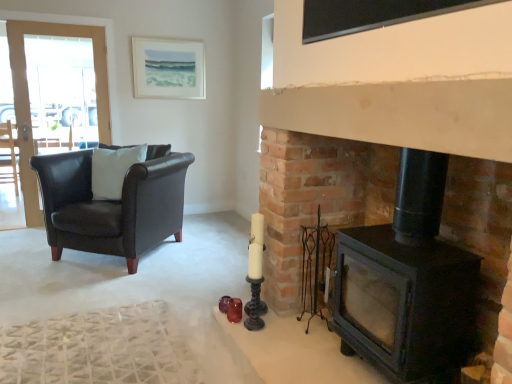
Question: Is black matte fireplace at right not near clear glass screen door at left?

Choices:
 (A) no
 (B) yes

Answer: (B)

Question: From a real-world perspective, is black matte fireplace at right located beneath clear glass screen door at left?

Choices:
 (A) no
 (B) yes

Answer: (B)

Question: From the image's perspective, is black matte fireplace at right on top of clear glass screen door at left?

Choices:
 (A) yes
 (B) no

Answer: (B)

Question: From a real-world perspective, is black matte fireplace at right physically above clear glass screen door at left?

Choices:
 (A) no
 (B) yes

Answer: (A)

Question: Is black matte fireplace at right to the left of clear glass screen door at left from the viewer's perspective?

Choices:
 (A) yes
 (B) no

Answer: (B)

Question: Could clear glass screen door at left be considered to be inside black matte fireplace at right?

Choices:
 (A) no
 (B) yes

Answer: (A)

Question: Considering the relative sizes of white matte pillow at left and black matte fireplace at right in the image provided, is white matte pillow at left smaller than black matte fireplace at right?

Choices:
 (A) yes
 (B) no

Answer: (A)

Question: Can you confirm if white matte pillow at left is positioned to the left of black matte fireplace at right?

Choices:
 (A) no
 (B) yes

Answer: (B)

Question: Considering the relative sizes of white matte pillow at left and black matte fireplace at right in the image provided, is white matte pillow at left thinner than black matte fireplace at right?

Choices:
 (A) no
 (B) yes

Answer: (B)

Question: From a real-world perspective, is white matte pillow at left on top of black matte fireplace at right?

Choices:
 (A) yes
 (B) no

Answer: (A)

Question: From a real-world perspective, is white matte pillow at left positioned under black matte fireplace at right based on gravity?

Choices:
 (A) no
 (B) yes

Answer: (A)

Question: Is white matte pillow at left touching black matte fireplace at right?

Choices:
 (A) yes
 (B) no

Answer: (B)

Question: From a real-world perspective, is white matte pillow at left below matte white picture frame at upper center?

Choices:
 (A) no
 (B) yes

Answer: (B)